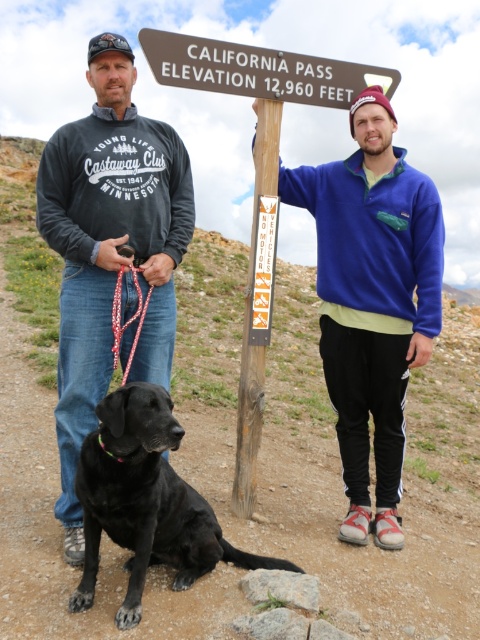
You are a photographer trying to capture the two points in the image. Which point, point (165, 285) or point (133, 547), is closer to your camera?

Point (133, 547) is closer to the camera because it is less further away than point (165, 285).

You are a hiker who wants to take a photo of the brown wooden sign at center and the wooden signpost at center. Which one is wider?

The brown wooden sign at center is wider than the wooden signpost at center because its width surpasses the latter.

You are planning to take a photo of the brown wooden sign at center and the wooden signpost at center. Which one should you focus on first if you want to capture both in sharp focus?

You should focus on the brown wooden sign at center first because it is closer to the camera than the wooden signpost at center, ensuring both are in focus when using depth of field properly.